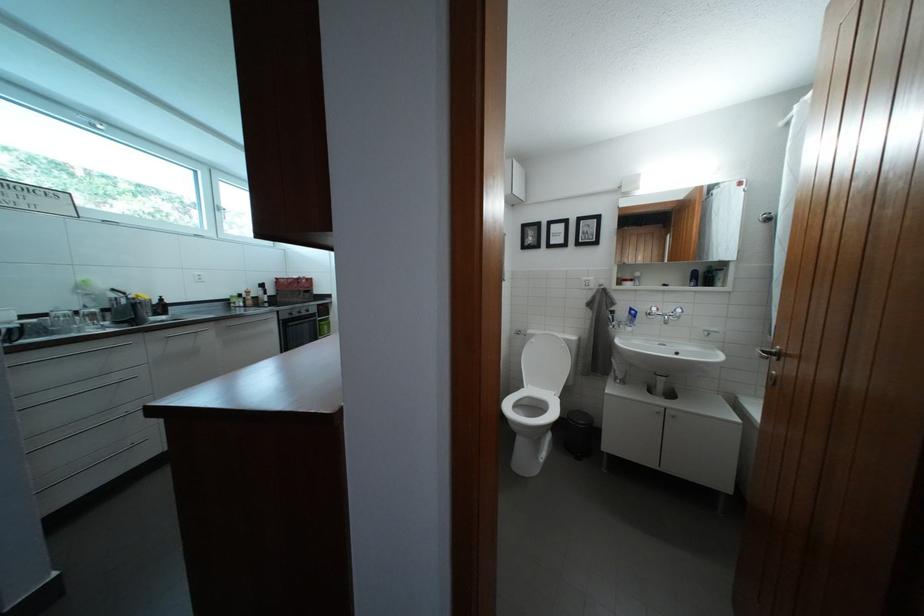
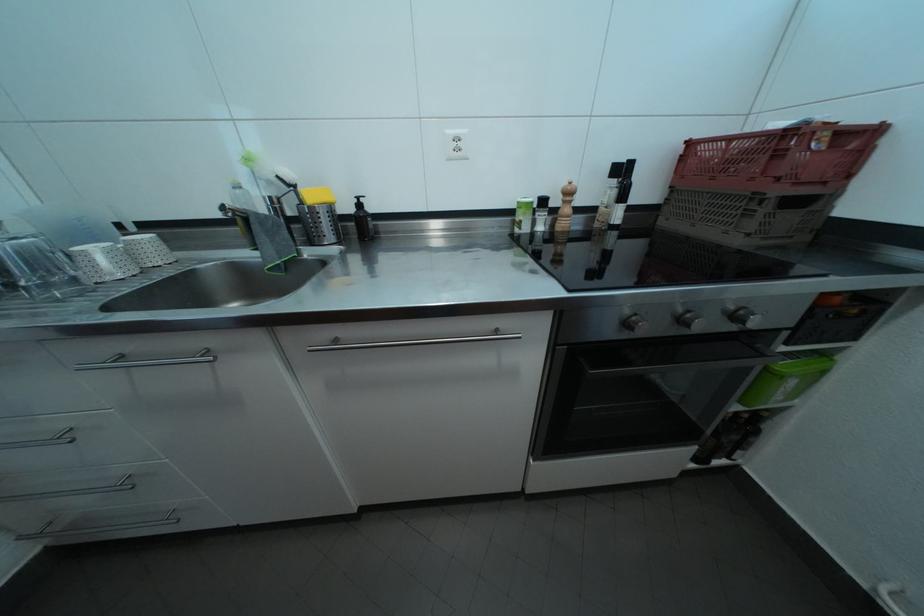
Locate, in the second image, the point that corresponds to the point at 308,289 in the first image.

(787, 161)